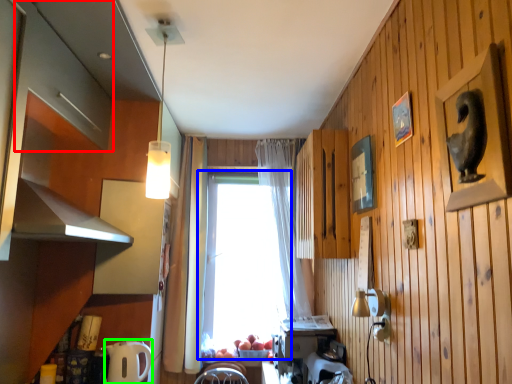
Question: Which object is the closest to the cabinetry (highlighted by a red box)? Choose among these: window (highlighted by a blue box) or appliance (highlighted by a green box).

Choices:
 (A) window
 (B) appliance

Answer: (B)